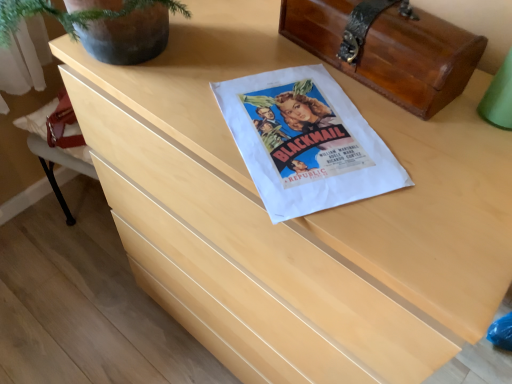
Find the location of a particular element. free spot above white paper flyer at center (from a real-world perspective) is located at coordinates (316, 128).